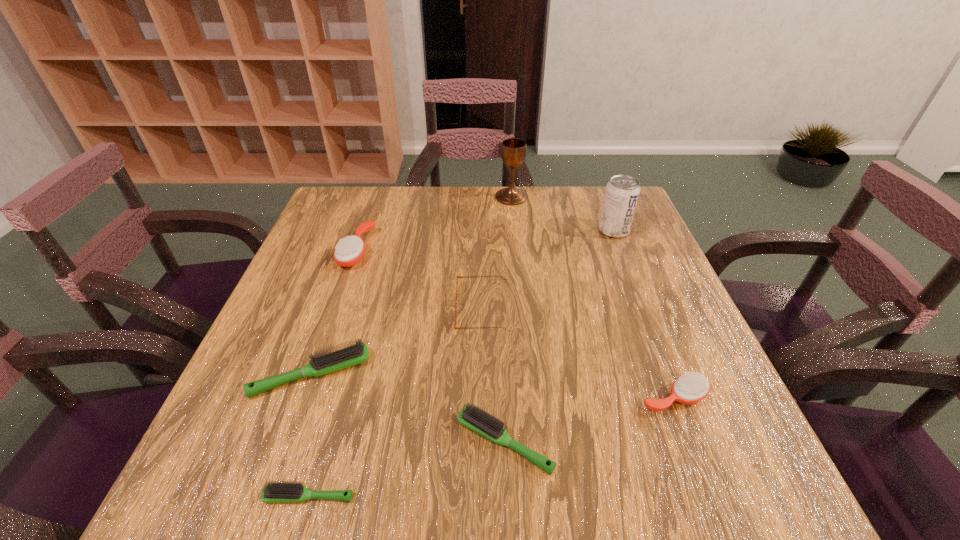
Locate an element on the screen. Image resolution: width=960 pixels, height=540 pixels. vacant space at the far edge is located at coordinates (506, 230).

Where is `free space at the near edge of the desktop`? This screenshot has width=960, height=540. free space at the near edge of the desktop is located at coordinates 482,478.

In the image, there is a desktop. What are the coordinates of `free space at the left edge` in the screenshot? It's located at (298, 360).

Where is `vacant region at the right edge of the desktop`? vacant region at the right edge of the desktop is located at coordinates (636, 327).

Identify the location of vacant space at the far left corner. Image resolution: width=960 pixels, height=540 pixels. coord(353,192).

In the image, there is a desktop. Find the location of `vacant space at the far right corner`. vacant space at the far right corner is located at coordinates (591, 189).

Identify the location of free space between the soda can and the rightmost light hairbrush. 559,336.

Where is `empty space between the rightmost light hairbrush and the biggest light hairbrush`? empty space between the rightmost light hairbrush and the biggest light hairbrush is located at coordinates (408, 408).

This screenshot has height=540, width=960. I want to click on free spot between the farthest light hairbrush and the fourth hairbrush from left to right, so click(408, 408).

Identify the location of free spot between the tallest hairbrush and the chalice. 434,224.